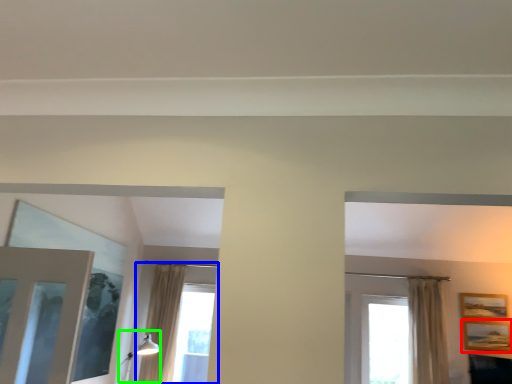
Question: Which object is positioned farthest from picture frame (highlighted by a red box)? Select from window (highlighted by a blue box) and light fixture (highlighted by a green box).

Choices:
 (A) window
 (B) light fixture

Answer: (A)